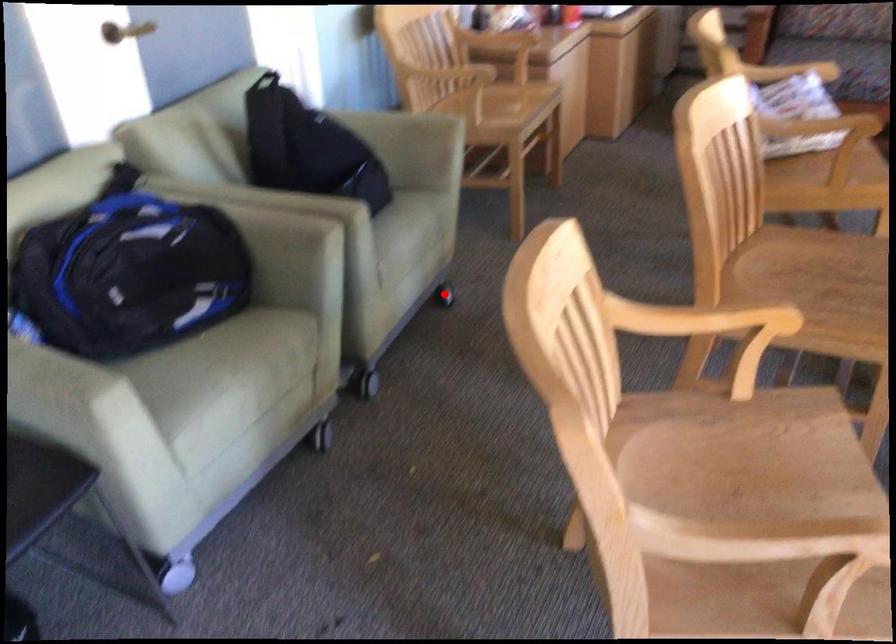
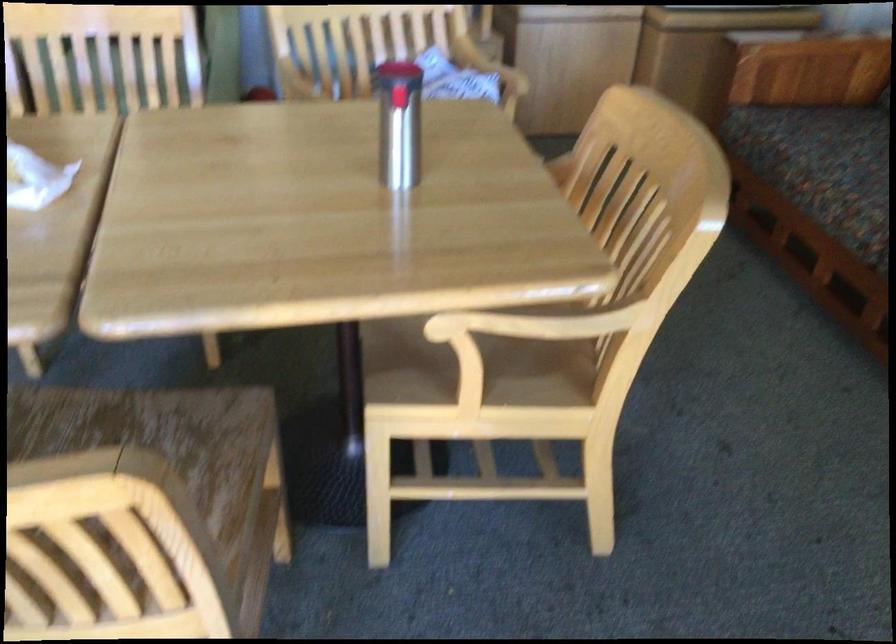
Question: I am providing you with two images of the same scene from different viewpoints. A red point is marked on the first image. At the location where the point appears in image 1, is it still visible in image 2?

Choices:
 (A) Yes
 (B) No

Answer: (B)